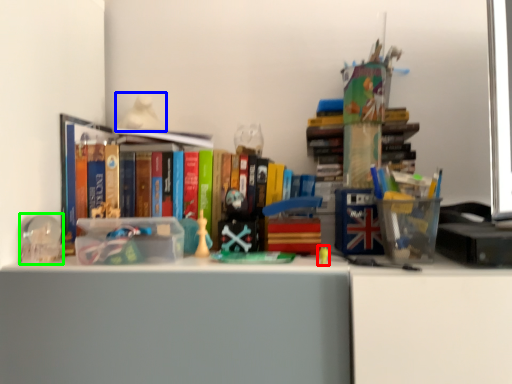
Question: Which object is positioned farthest from toy (highlighted by a red box)? Select from toy (highlighted by a blue box) and stationery (highlighted by a green box).

Choices:
 (A) toy
 (B) stationery

Answer: (A)